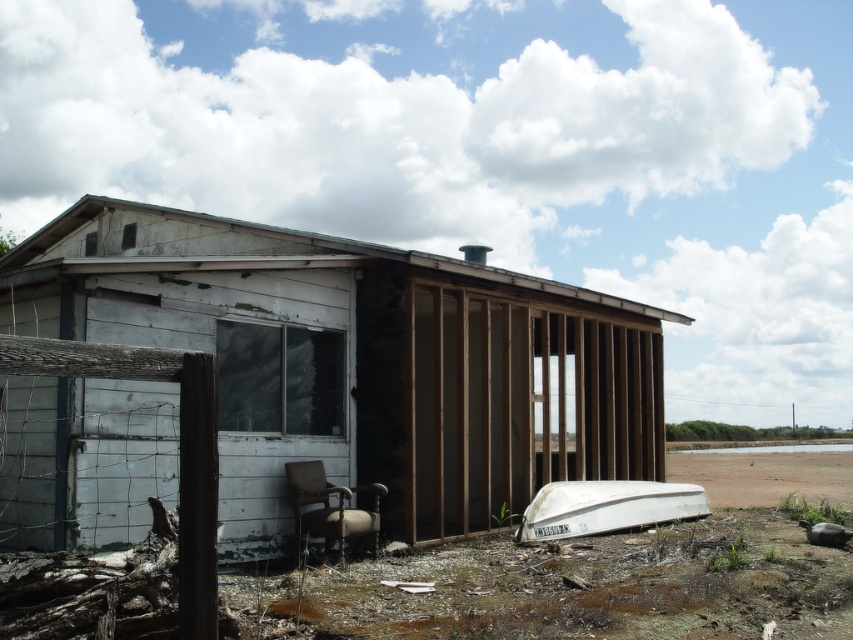
Which is more to the left, white wood hut at center or white matte boat at lower right?

From the viewer's perspective, white wood hut at center appears more on the left side.

Who is more distant from viewer, (564,417) or (567,499)?

The point (564,417) is behind.

What do you see at coordinates (358, 362) in the screenshot?
I see `white wood hut at center` at bounding box center [358, 362].

Where is `white wood hut at center`? Image resolution: width=853 pixels, height=640 pixels. white wood hut at center is located at coordinates (358, 362).

Which is more to the right, brown sandy dirt at lower right or white matte boat at lower right?

brown sandy dirt at lower right

Which is below, brown sandy dirt at lower right or white matte boat at lower right?

brown sandy dirt at lower right

Is point (811, 486) more distant than point (706, 506)?

That is True.

Image resolution: width=853 pixels, height=640 pixels. Find the location of `brown sandy dirt at lower right`. brown sandy dirt at lower right is located at coordinates (764, 474).

Does white wood hut at center come behind brown sandy dirt at lower right?

That is False.

Can you confirm if white wood hut at center is wider than brown sandy dirt at lower right?

In fact, white wood hut at center might be narrower than brown sandy dirt at lower right.

In order to click on white wood hut at center in this screenshot , I will do `click(358, 362)`.

Find the location of a particular element. white wood hut at center is located at coordinates (358, 362).